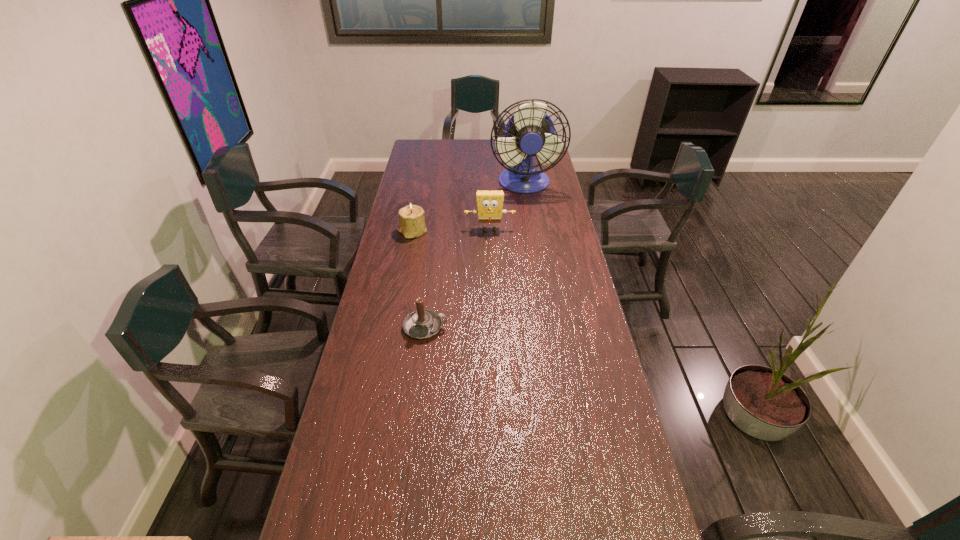
Image resolution: width=960 pixels, height=540 pixels. Find the location of `free point between the candle_holder and the sponge`. free point between the candle_holder and the sponge is located at coordinates (451, 231).

Image resolution: width=960 pixels, height=540 pixels. Find the location of `vacant space that is in between the sponge and the candle_holder`. vacant space that is in between the sponge and the candle_holder is located at coordinates (451, 231).

You are a GUI agent. You are given a task and a screenshot of the screen. Output one action in this format:
    pyautogui.click(x=<x>, y=<y>)
    Task: Click on the empty location between the candle_holder and the fan
    Image resolution: width=960 pixels, height=540 pixels.
    Given the screenshot: What is the action you would take?
    [x=468, y=208]

Find the location of a particular element. vacant space in between the candle and the tallest object is located at coordinates (475, 255).

This screenshot has width=960, height=540. Find the location of `free space between the candle_holder and the fan`. free space between the candle_holder and the fan is located at coordinates (468, 208).

Identify the location of object identified as the third closest to the farthest object. (421, 324).

Find the location of a particular element. The height and width of the screenshot is (540, 960). object that is the second closest to the farthest object is located at coordinates (412, 224).

This screenshot has height=540, width=960. I want to click on free space that satisfies the following two spatial constraints: 1. in front of the farthest object where the airflow is directed; 2. on the side of the candle with the handle loop, so click(x=546, y=327).